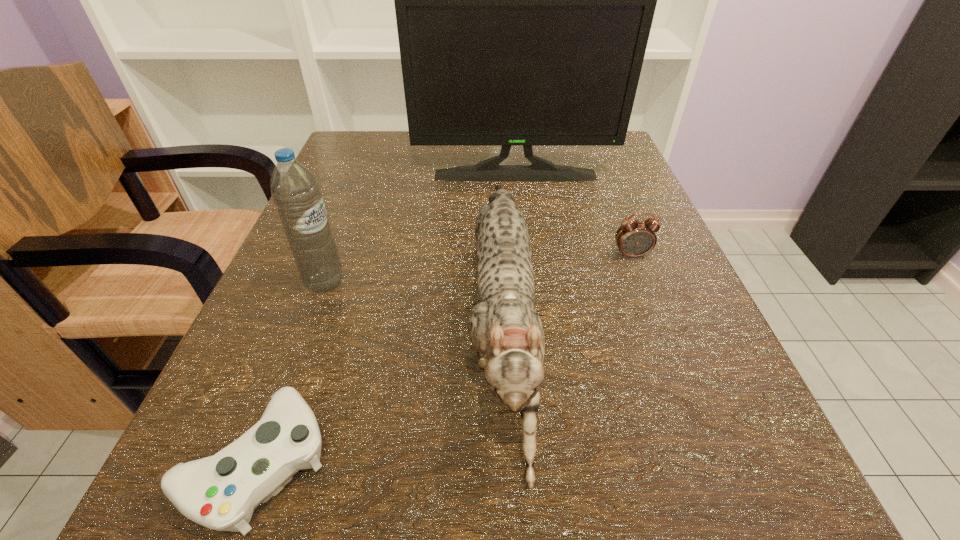
Where is `object that is positioned at the left edge`? Image resolution: width=960 pixels, height=540 pixels. object that is positioned at the left edge is located at coordinates (294, 188).

Locate an element on the screen. The width and height of the screenshot is (960, 540). monitor located in the right edge section of the desktop is located at coordinates (524, 0).

Image resolution: width=960 pixels, height=540 pixels. I want to click on alarm clock at the right edge, so click(635, 238).

Find the location of a particular element. The image size is (960, 540). object that is positioned at the far right corner is located at coordinates (524, 0).

This screenshot has height=540, width=960. I want to click on vacant space at the left edge of the desktop, so pos(329,194).

Find the location of a particular element. The height and width of the screenshot is (540, 960). vacant position at the right edge of the desktop is located at coordinates (587, 211).

At what (x,y) coordinates should I click in order to perform the action: click on free location at the far left corner of the desktop. Please return your answer as a coordinate pair (x, y). Looking at the image, I should click on (346, 183).

In the image, there is a desktop. Where is `vacant space at the far right corner`? vacant space at the far right corner is located at coordinates (619, 181).

This screenshot has width=960, height=540. In order to click on vacant space at the near right corner of the desktop in this screenshot , I will do `click(782, 469)`.

Image resolution: width=960 pixels, height=540 pixels. I want to click on empty location between the water bottle and the farthest object, so click(x=420, y=228).